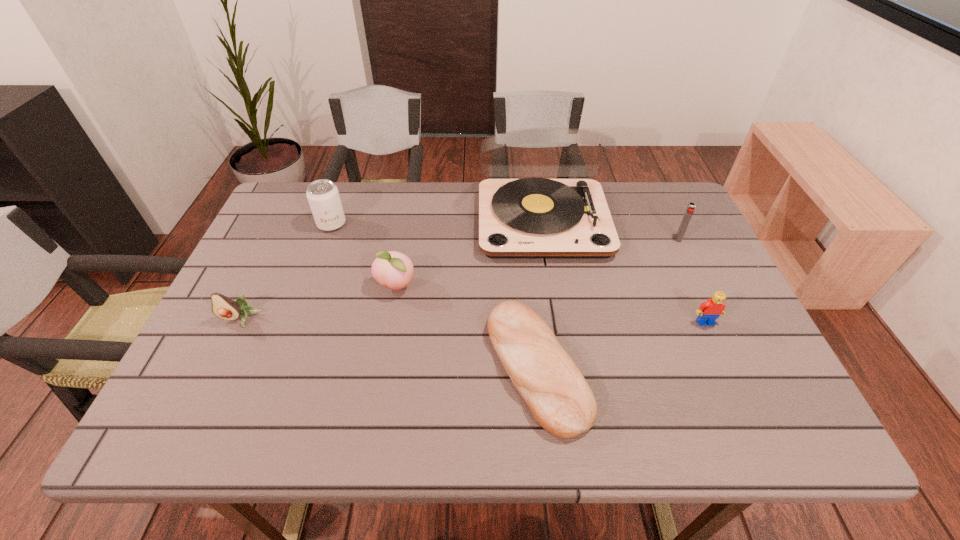
I want to click on igniter at the right edge, so click(x=690, y=210).

The image size is (960, 540). What are the coordinates of `Lego present at the right edge` in the screenshot? It's located at (708, 312).

Identify the location of object at the far left corner. (323, 196).

What are the coordinates of `vacant space at the far edge of the desktop` in the screenshot? It's located at (341, 195).

The image size is (960, 540). In the image, there is a desktop. Find the location of `vacant space at the near edge`. vacant space at the near edge is located at coordinates (269, 408).

Find the location of `vacant region at the left edge of the desktop`. vacant region at the left edge of the desktop is located at coordinates (257, 336).

The height and width of the screenshot is (540, 960). In order to click on vacant point at the right edge in this screenshot , I will do `click(691, 296)`.

This screenshot has width=960, height=540. Identify the location of vacant region at the near left corner of the desktop. (210, 421).

The height and width of the screenshot is (540, 960). What are the coordinates of `free space between the second object from left to right and the Lego` in the screenshot? It's located at (518, 273).

Where is `vacant area between the Lego and the shortest object`? Image resolution: width=960 pixels, height=540 pixels. vacant area between the Lego and the shortest object is located at coordinates (621, 345).